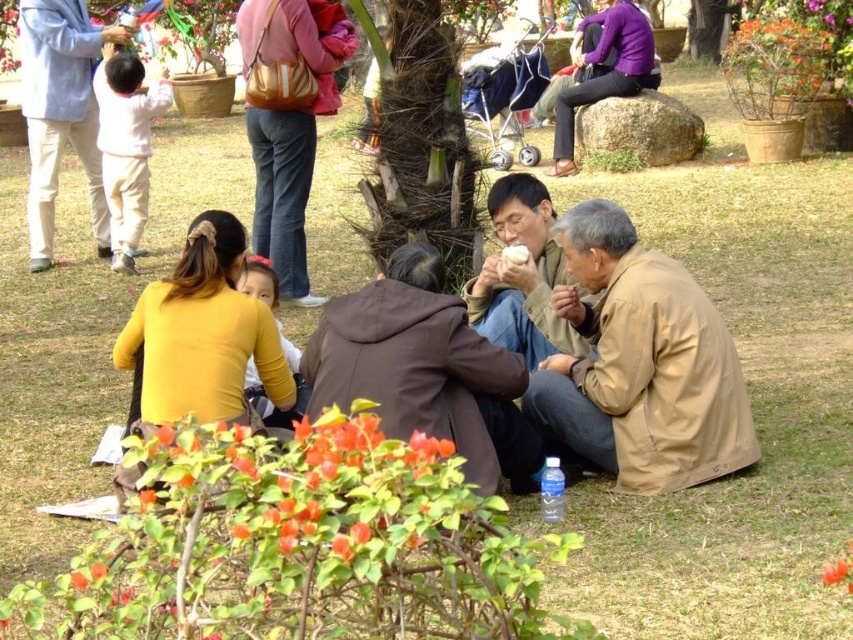
You are standing at the center of the park and see the point marked at coordinates (x=61, y=113). What object is located at that point?

The point at coordinates (x=61, y=113) corresponds to the light blue denim jacket at upper left.

You are at a park and want to take a photo of the brown suede jacket at center. Your camera is 14.05 feet away from the jacket. Is the camera close enough to capture the jacket clearly in the photo?

The camera is 14.05 feet away from the brown suede jacket at center. Since most cameras can focus at that distance, the camera should be close enough to capture the jacket clearly.